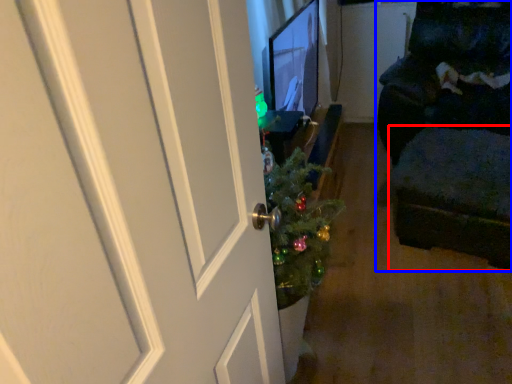
Question: Which point is further to the camera, footrest (highlighted by a red box) or furniture (highlighted by a blue box)?

Choices:
 (A) footrest
 (B) furniture

Answer: (B)